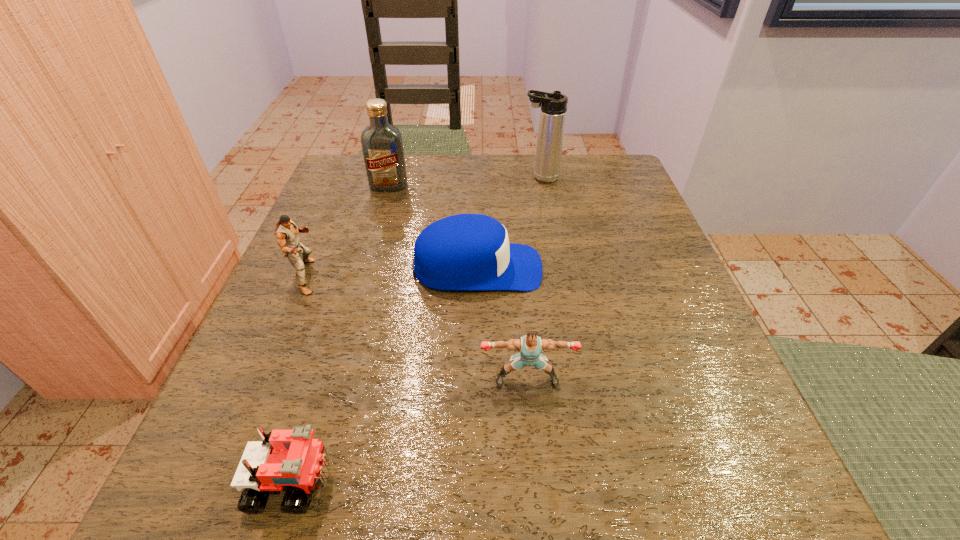
What are the coordinates of `puncher that is at the left edge` in the screenshot? It's located at (286, 231).

The image size is (960, 540). Identify the location of Lego that is at the left edge. (286, 458).

Where is `object that is at the far left corner`? object that is at the far left corner is located at coordinates (382, 145).

Find the location of a particular element. object that is at the near left corner is located at coordinates tap(286, 458).

What are the coordinates of `vacant region at the far edge of the desktop` in the screenshot? It's located at (417, 166).

This screenshot has width=960, height=540. In the image, there is a desktop. Identify the location of free space at the near edge. (598, 497).

At what (x,y) coordinates should I click in order to perform the action: click on vacant space at the left edge of the desktop. Please return your answer as a coordinate pair (x, y). The width and height of the screenshot is (960, 540). Looking at the image, I should click on (368, 290).

Where is `free region at the right edge of the desktop`? free region at the right edge of the desktop is located at coordinates (694, 439).

What are the coordinates of `vacant space at the far left corner` in the screenshot? It's located at (331, 197).

I want to click on vacant space at the near right corner of the desktop, so click(670, 495).